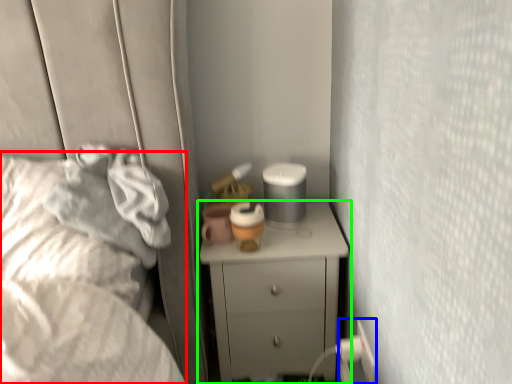
Question: Which object is the closest to the bed (highlighted by a red box)? Choose among these: electric outlet (highlighted by a blue box) or chest of drawers (highlighted by a green box).

Choices:
 (A) electric outlet
 (B) chest of drawers

Answer: (B)